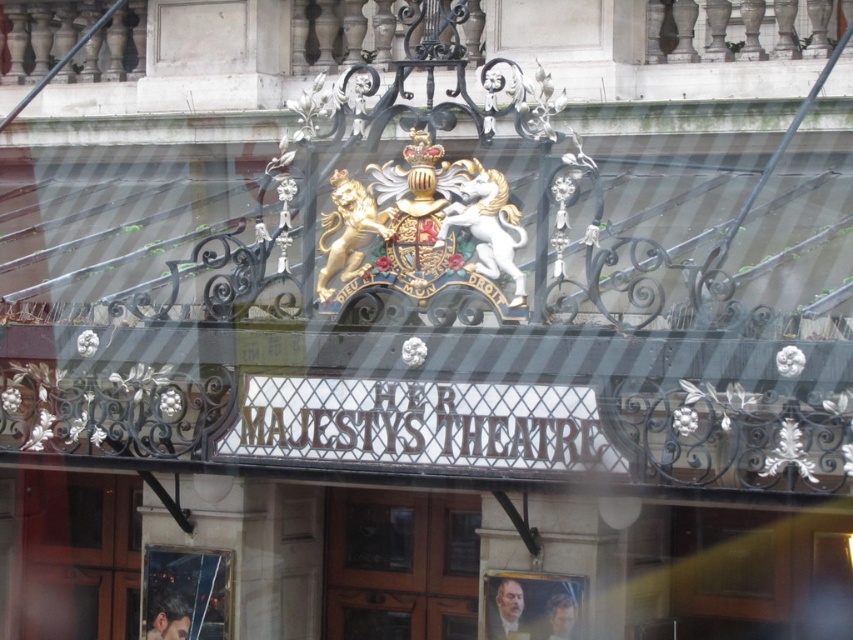
Question: From the image, what is the correct spatial relationship of transparent glass window at lower left in relation to matte glass portrait at lower center?

Choices:
 (A) left
 (B) right

Answer: (A)

Question: Is transparent glass window at lower left above matte glass portrait at lower center?

Choices:
 (A) yes
 (B) no

Answer: (B)

Question: Which point is closer to the camera?

Choices:
 (A) matte glass portrait at lower center
 (B) transparent glass window at lower left

Answer: (A)

Question: From the image, what is the correct spatial relationship of transparent glass window at lower left in relation to matte glass portrait at lower center?

Choices:
 (A) right
 (B) left

Answer: (B)

Question: Which point is farther from the camera taking this photo?

Choices:
 (A) (225, 593)
 (B) (506, 636)

Answer: (A)

Question: Which of the following is the closest to the observer?

Choices:
 (A) (177, 616)
 (B) (538, 625)

Answer: (B)